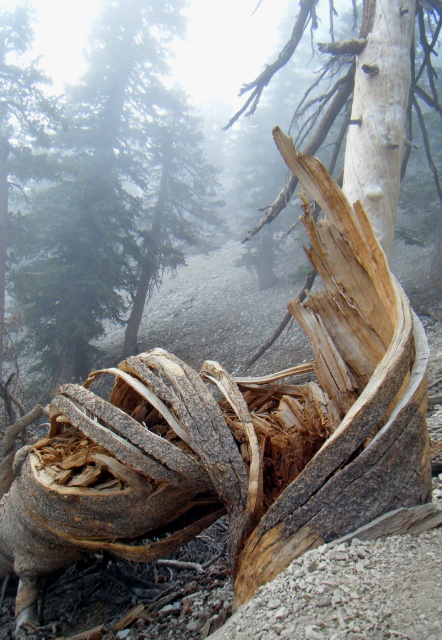
Is point (117, 164) farther from viewer compared to point (373, 196)?

Yes, point (117, 164) is behind point (373, 196).

Is rough bark tree trunk at center to the right of white textured bark at upper right from the viewer's perspective?

In fact, rough bark tree trunk at center is to the left of white textured bark at upper right.

Between point (88, 60) and point (388, 26), which one is positioned behind?

Positioned behind is point (88, 60).

What are the coordinates of `rough bark tree trunk at center` in the screenshot? It's located at pos(111,193).

Does rough bark tree trunk at center have a lesser height compared to white textured bark at center?

Incorrect, rough bark tree trunk at center's height does not fall short of white textured bark at center's.

Is point (162, 40) more distant than point (420, 28)?

Yes, point (162, 40) is farther from viewer.

The image size is (442, 640). Describe the element at coordinates (111, 193) in the screenshot. I see `rough bark tree trunk at center` at that location.

The width and height of the screenshot is (442, 640). Find the location of `rough bark tree trunk at center`. rough bark tree trunk at center is located at coordinates coord(111,193).

Does white textured bark at center have a larger size compared to white textured bark at upper right?

Incorrect, white textured bark at center is not larger than white textured bark at upper right.

Between white textured bark at center and white textured bark at upper right, which one appears on the right side from the viewer's perspective?

white textured bark at center

What do you see at coordinates (381, 106) in the screenshot? I see `white textured bark at center` at bounding box center [381, 106].

You are a GUI agent. You are given a task and a screenshot of the screen. Output one action in this format:
    pyautogui.click(x=<x>, y=<y>)
    Task: Click on the white textured bark at center
    This screenshot has width=442, height=640.
    Given the screenshot: What is the action you would take?
    pyautogui.click(x=381, y=106)